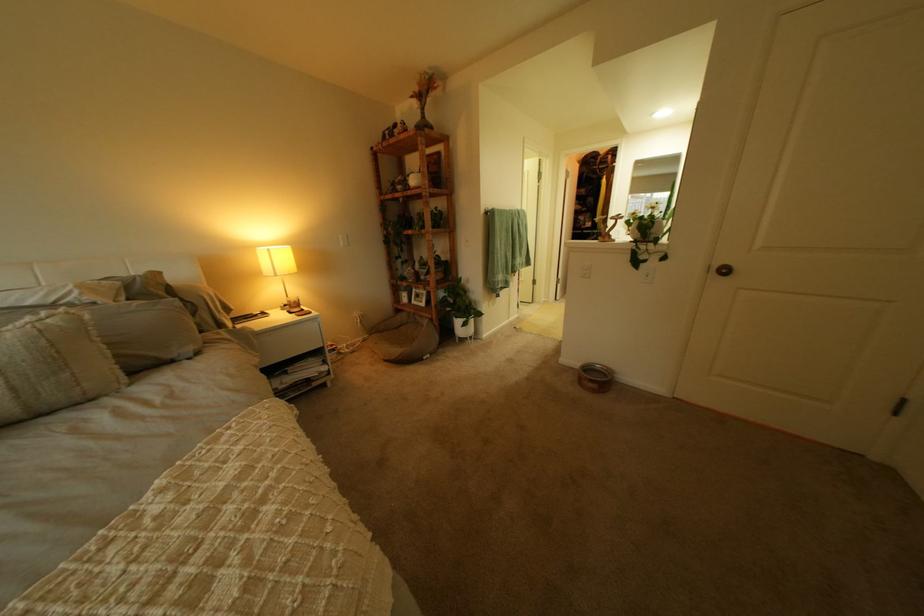
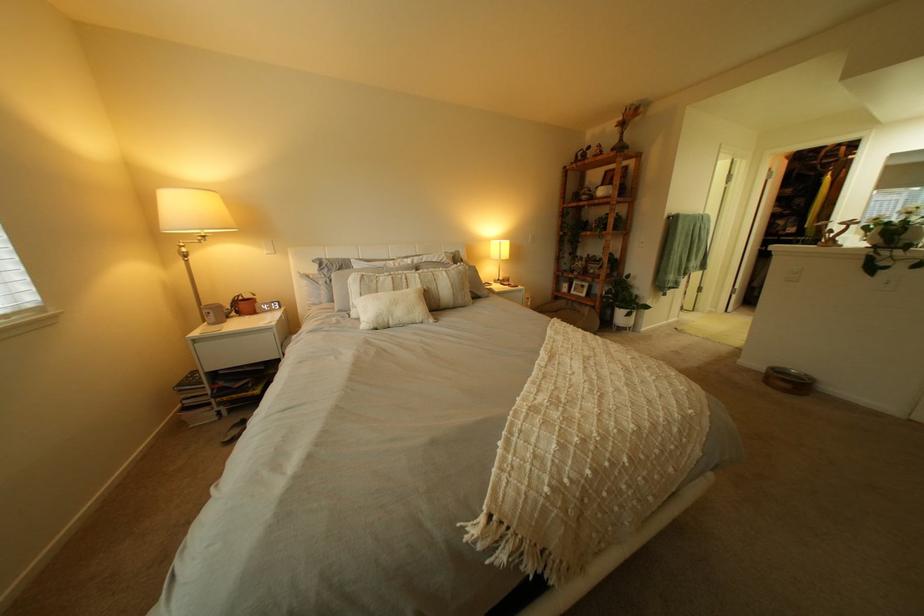
Where in the second image is the point corresponding to point (468, 314) from the first image?

(633, 305)